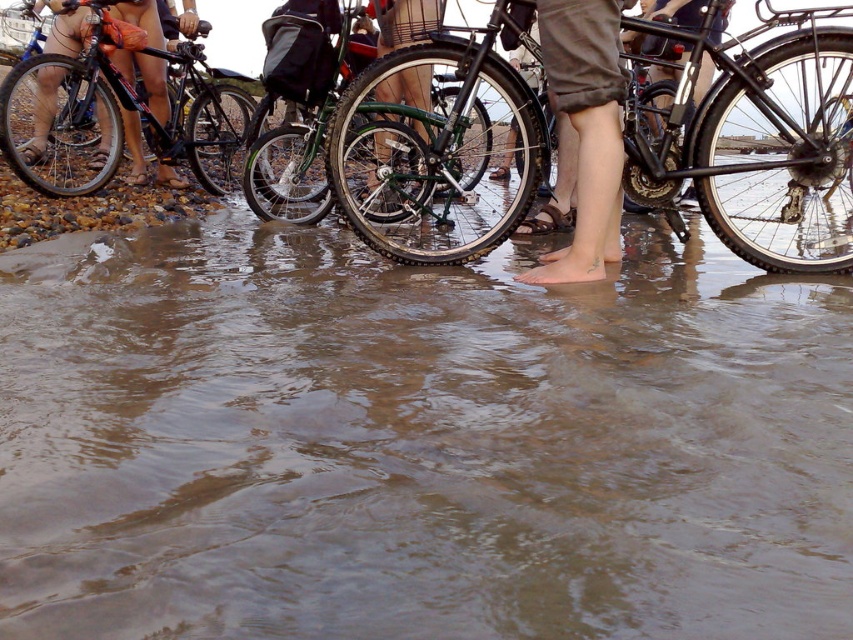
You are a photographer trying to capture a wide shot of the beach scene. You notice the skinny jeans at lower center and the green matte bicycle at center. Based on their widths, which object would require more space in the frame to fully capture?

The skinny jeans at lower center would require more space in the frame since their width surpasses that of the green matte bicycle at center.

You are standing at the edge of the beach and see the brown murky water at center and the shiny black bicycle at upper left. Which object is located to the right of the other?

The brown murky water at center is positioned on the right side of shiny black bicycle at upper left.